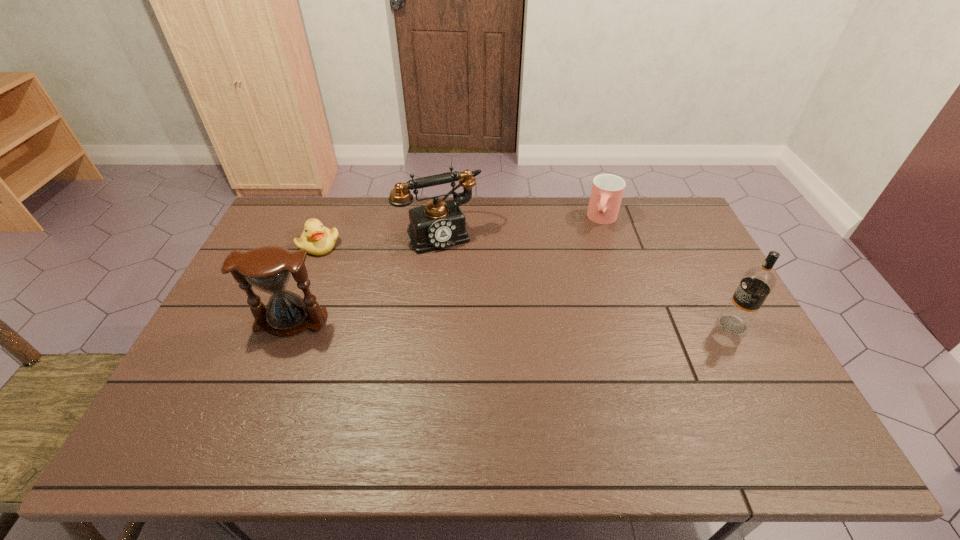
At what (x,y) coordinates should I click in order to perform the action: click on telephone that is at the far edge. Please return your answer as a coordinate pair (x, y). The height and width of the screenshot is (540, 960). Looking at the image, I should click on (439, 224).

The width and height of the screenshot is (960, 540). I want to click on cup that is positioned at the far edge, so click(607, 191).

Identify the location of hourglass at the left edge. This screenshot has width=960, height=540. (268, 268).

I want to click on duckling that is positioned at the left edge, so click(x=316, y=239).

Identify the location of object that is at the right edge. (757, 283).

The width and height of the screenshot is (960, 540). What are the coordinates of `object that is positioned at the far left corner` in the screenshot? It's located at (316, 239).

This screenshot has width=960, height=540. I want to click on blank space at the far edge, so click(464, 209).

This screenshot has height=540, width=960. In the image, there is a desktop. Find the location of `vacant space at the near edge`. vacant space at the near edge is located at coordinates (429, 409).

Identify the location of vacant space at the right edge. This screenshot has height=540, width=960. (670, 241).

Locate an element on the screen. vacant space at the far left corner is located at coordinates (286, 221).